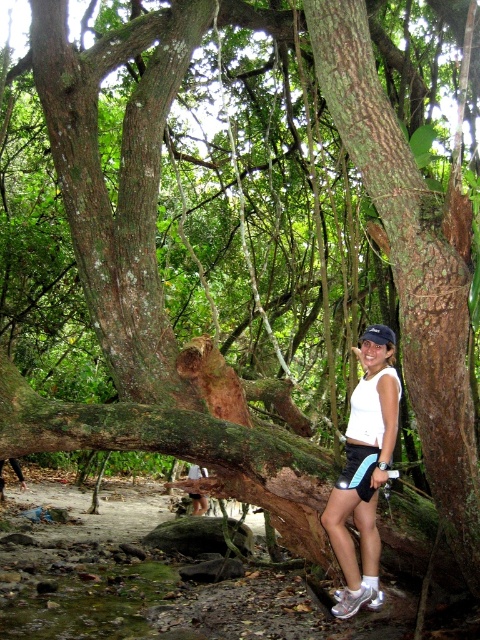
You are navigating through the tropical forest and need to reach a specific location marked by the point at coordinates point (424,298) and point (363,492). Which of these two points is closer to your current position?

Point (424,298) is closer to the viewer than point (363,492), so the point at coordinates point (424,298) is closer to your current position.

You are a photographer trying to capture a photo of the brown rough tree trunk at center and the white matte shorts at center. If you want to focus on the tree trunk, which object should you adjust your camera to be closer to?

The brown rough tree trunk at center is in front of the white matte shorts at center, so to focus on the tree trunk, adjust your camera to be closer to the brown rough tree trunk at center.

You are a photographer trying to capture the brown rough tree trunk at center and the white matte shorts at center in the same frame. Which object should you focus on first if you want to ensure both are clearly visible in your photo?

The brown rough tree trunk at center is larger in size than the white matte shorts at center, so you should focus on the brown rough tree trunk at center first to ensure both are in focus.